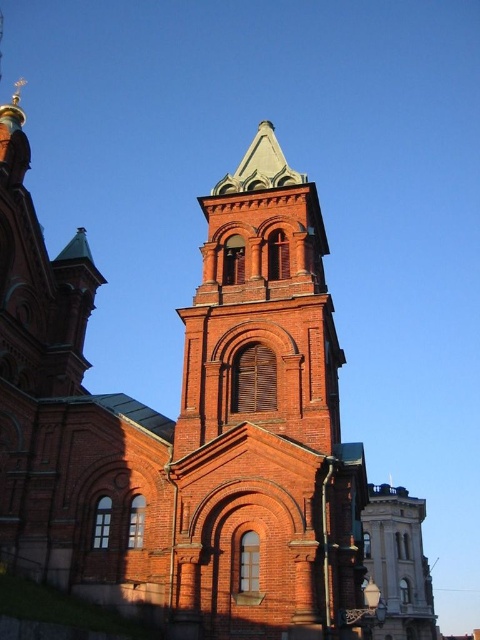
Can you confirm if red brick tower at center is positioned to the right of smooth gray stone tower at center?

No, red brick tower at center is not to the right of smooth gray stone tower at center.

This screenshot has width=480, height=640. What do you see at coordinates (264, 420) in the screenshot? I see `red brick tower at center` at bounding box center [264, 420].

Where is `red brick tower at center`? This screenshot has width=480, height=640. red brick tower at center is located at coordinates (264, 420).